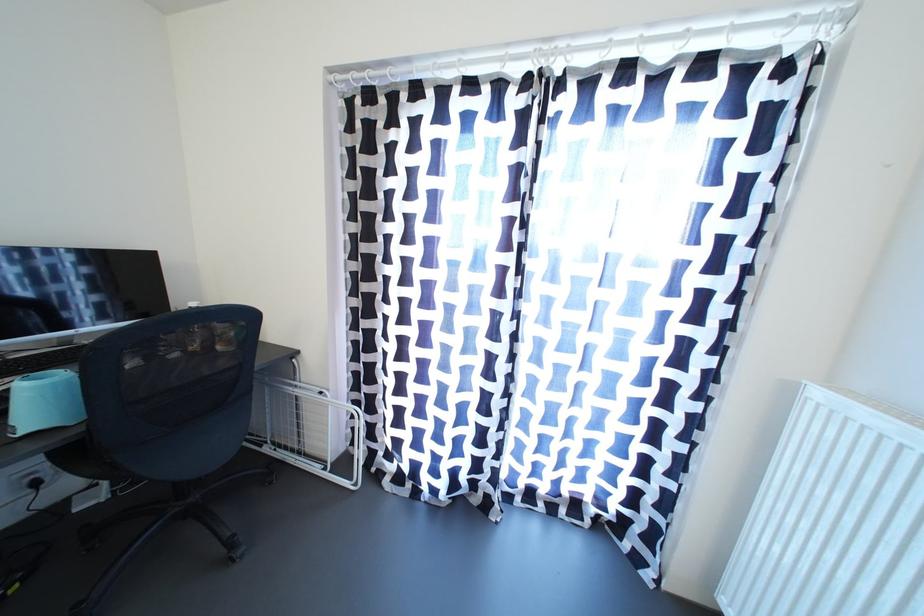
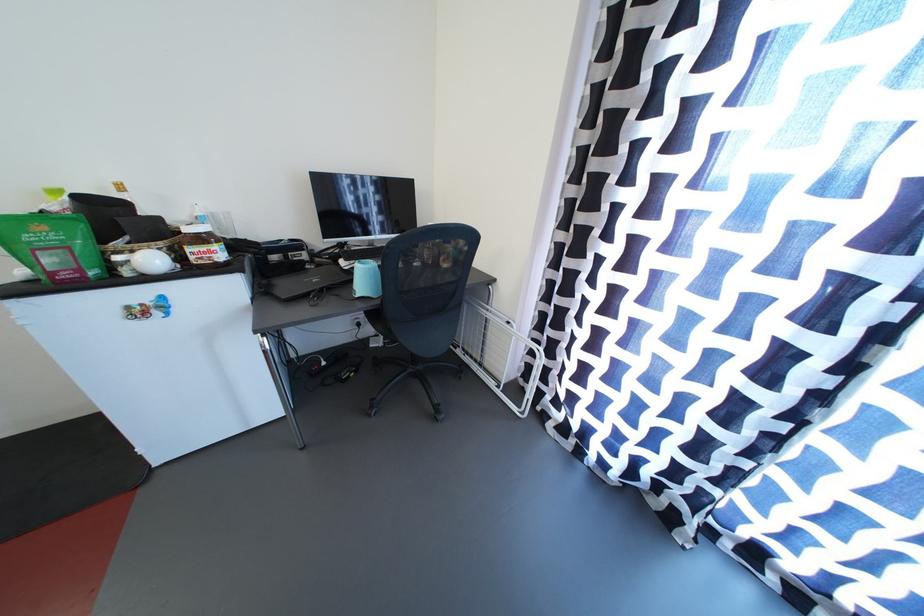
The images are taken continuously from a first-person perspective. In which direction is your viewpoint rotating?

The camera's rotation is toward left-down.